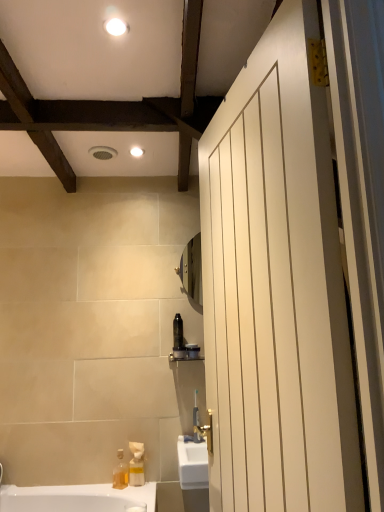
Question: From a real-world perspective, is translucent plastic soap dispenser at lower left physically located above or below matte black toothbrush at center?

Choices:
 (A) above
 (B) below

Answer: (B)

Question: From the image's perspective, is translucent plastic soap dispenser at lower left located above or below matte black toothbrush at center?

Choices:
 (A) below
 (B) above

Answer: (A)

Question: Which object is the closest to the matte black toothbrush at center?

Choices:
 (A) translucent plastic soap dispenser at lower left
 (B) white glossy light fixture at upper center, the second light fixture positioned from the back
 (C) white matte door at right
 (D) white glossy light fixture at upper center, positioned as the second light fixture in front-to-back order

Answer: (A)

Question: Estimate the real-world distances between objects in this image. Which object is closer to the matte black toothbrush at center?

Choices:
 (A) white glossy light fixture at upper center, which is the 1th light fixture in bottom-to-top order
 (B) white glossy light fixture at upper center, which is the first light fixture from top to bottom
 (C) white matte door at right
 (D) translucent plastic soap dispenser at lower left

Answer: (D)